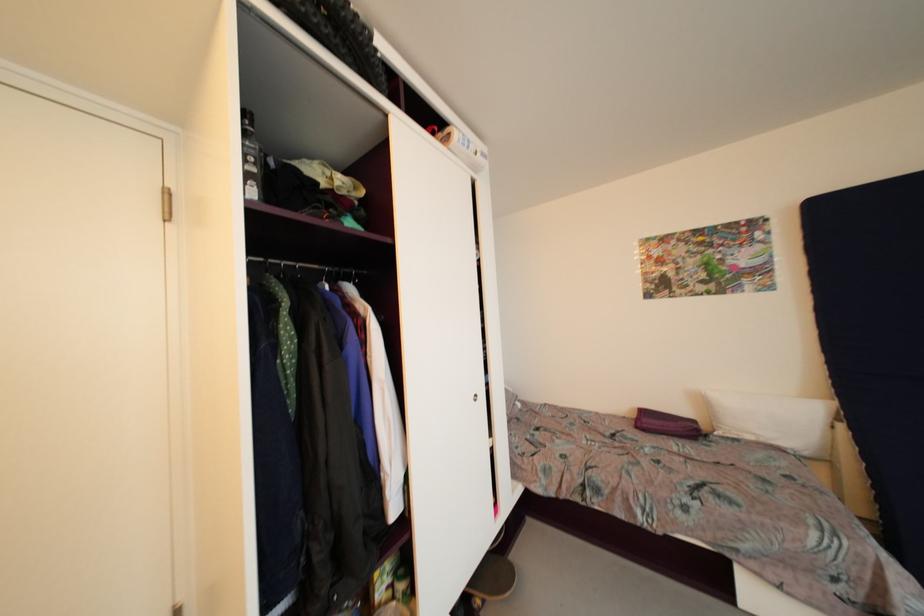
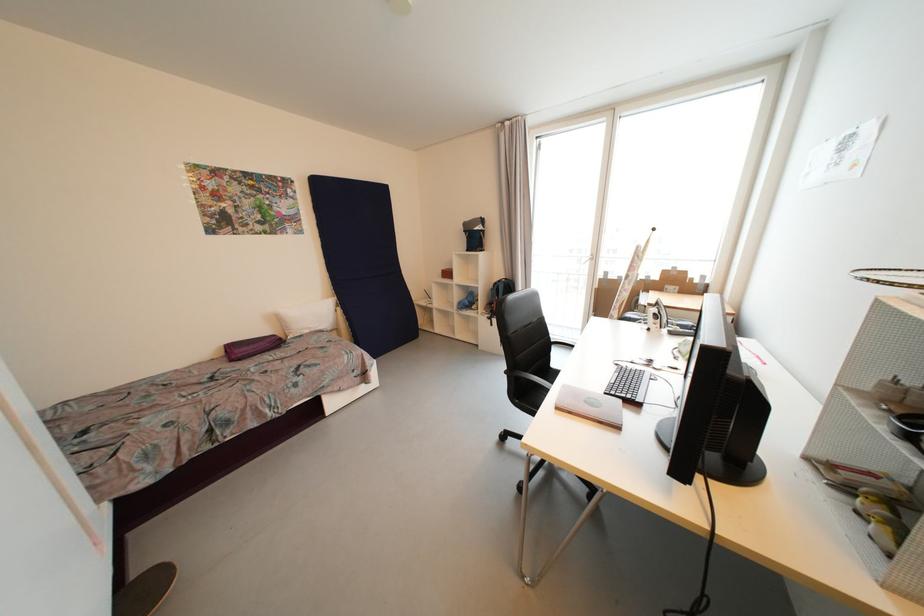
Find the pixel in the second image that matches [847,428] in the first image.

(344, 310)